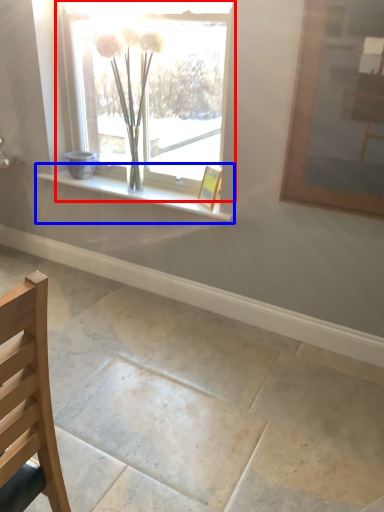
Question: Which object is further to the camera taking this photo, window (highlighted by a red box) or window sill (highlighted by a blue box)?

Choices:
 (A) window
 (B) window sill

Answer: (B)